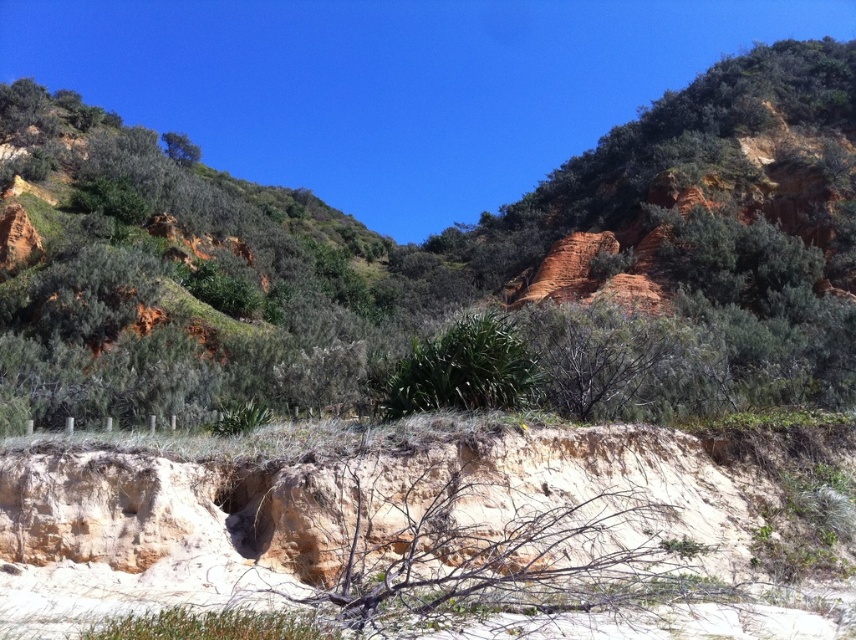
Which of these two, rustic clay hill at center or green leafy tree at upper left, stands taller?

rustic clay hill at center

Is point (661, 134) in front of point (171, 148)?

Yes, it is in front of point (171, 148).

Find the location of a particular element. rustic clay hill at center is located at coordinates (456, 262).